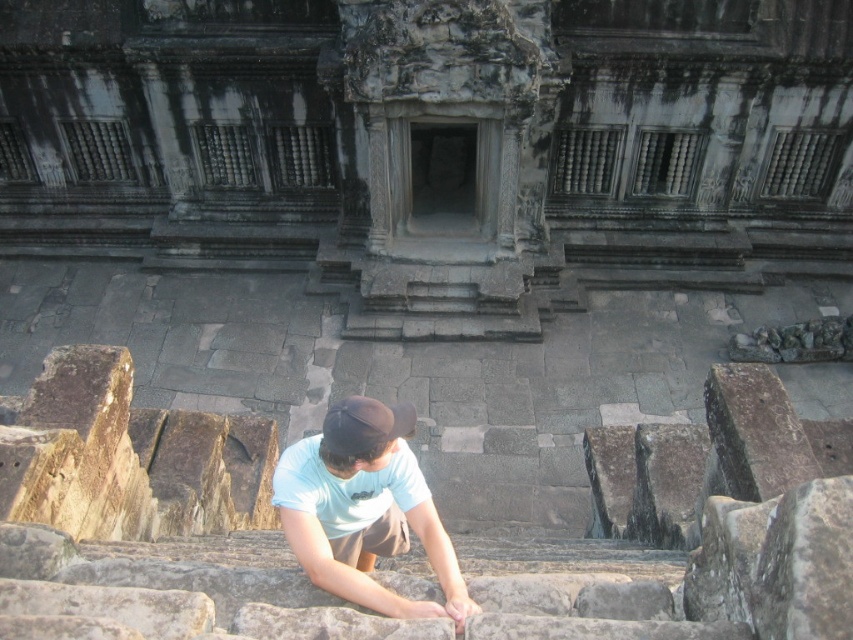
Is light blue t-shirt at center above black fabric baseball cap at center?

Incorrect, light blue t-shirt at center is not positioned above black fabric baseball cap at center.

Is point (318, 454) closer to camera compared to point (405, 413)?

That is True.

In order to click on light blue t-shirt at center in this screenshot , I will do `click(364, 508)`.